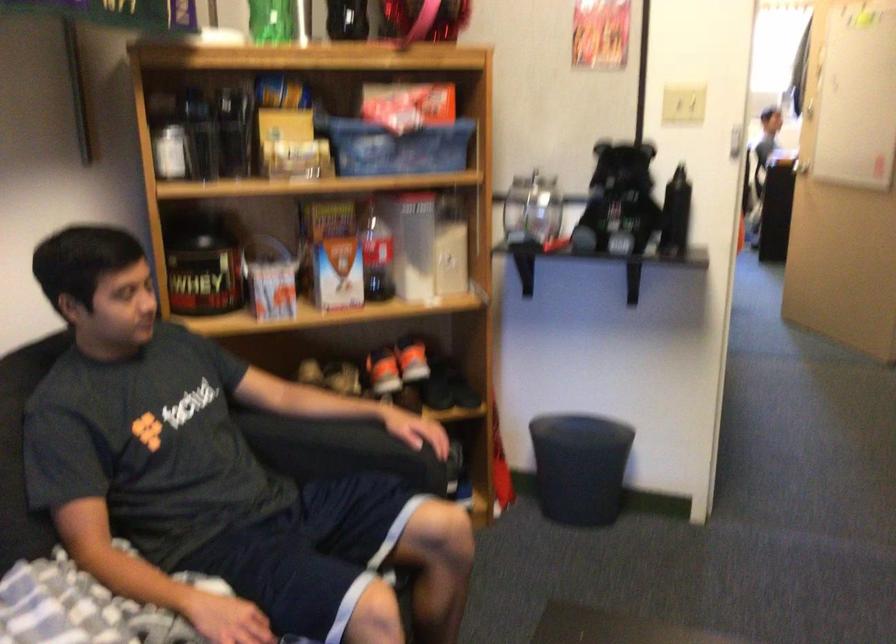
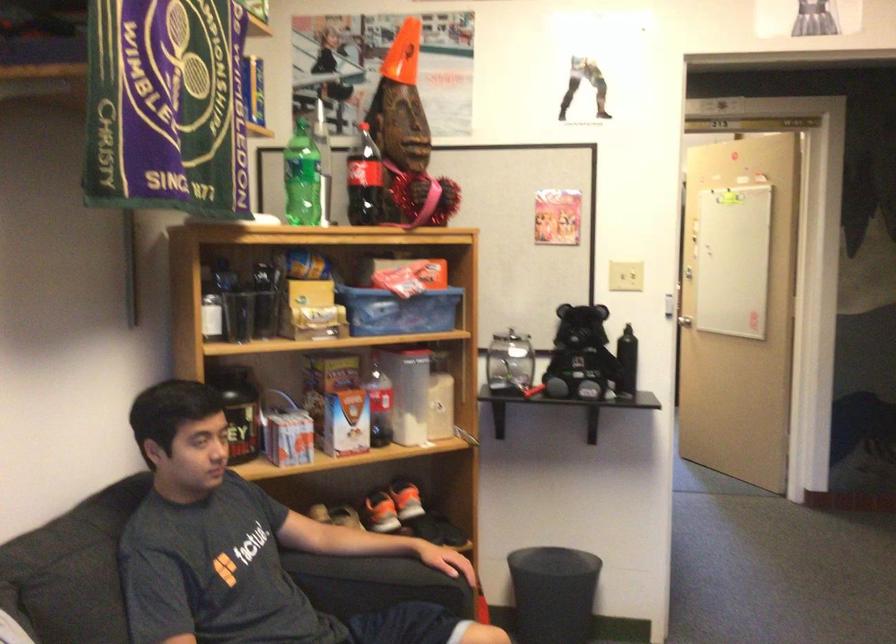
The images are taken continuously from a first-person perspective. In which direction are you moving?

The cameraman walked toward left, backward.